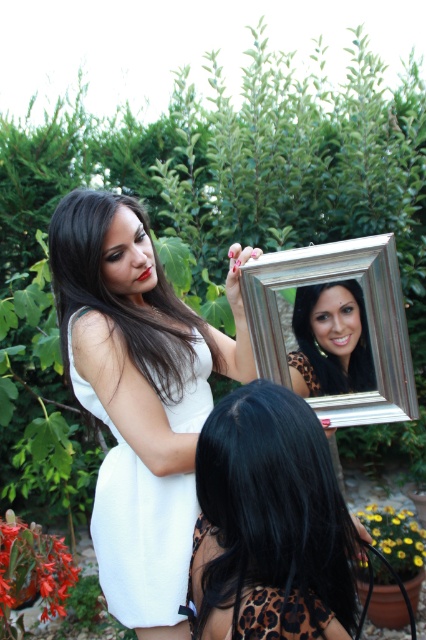
You are a fashion designer observing the two elements in the image. Which object is wider, the black leopard print dress at lower center or the matte black hair at upper center?

The black leopard print dress at lower center is wider than the matte black hair at upper center according to the description.

You are standing at the point labeled as point (x=236, y=532) and want to move towards the point labeled as point (x=78, y=381). Which direction should you move to reach there?

Since point (x=78, y=381) is behind point (x=236, y=532), you should move backward to reach it.